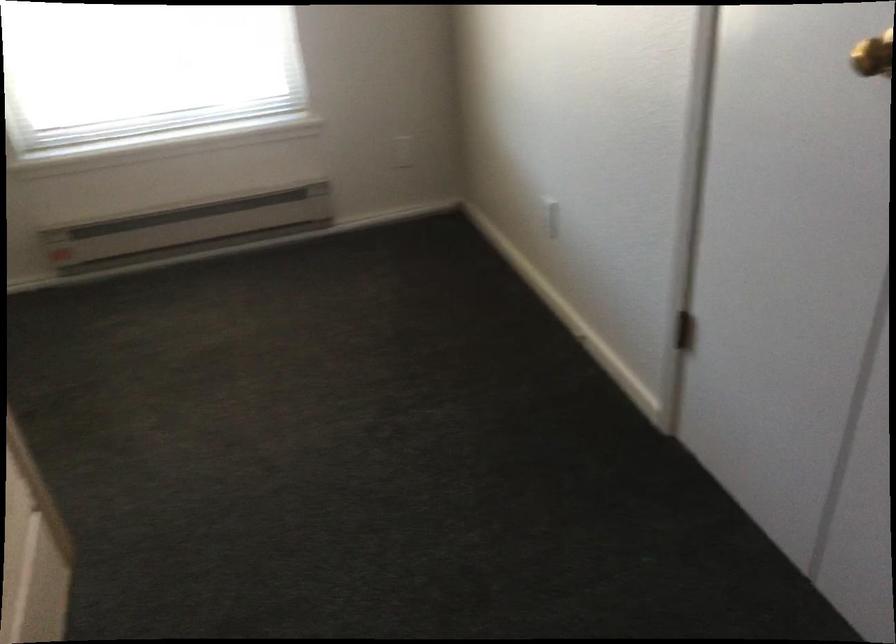
Where would you pull the brass doorknob? Please return your answer as a coordinate pair (x, y).

(872, 55)